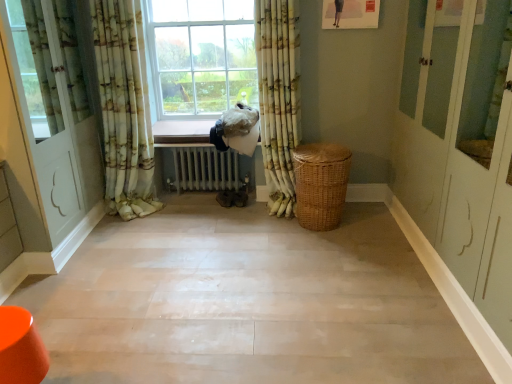
Locate an element on the screen. vacant space in front of metallic radiator at center is located at coordinates (210, 224).